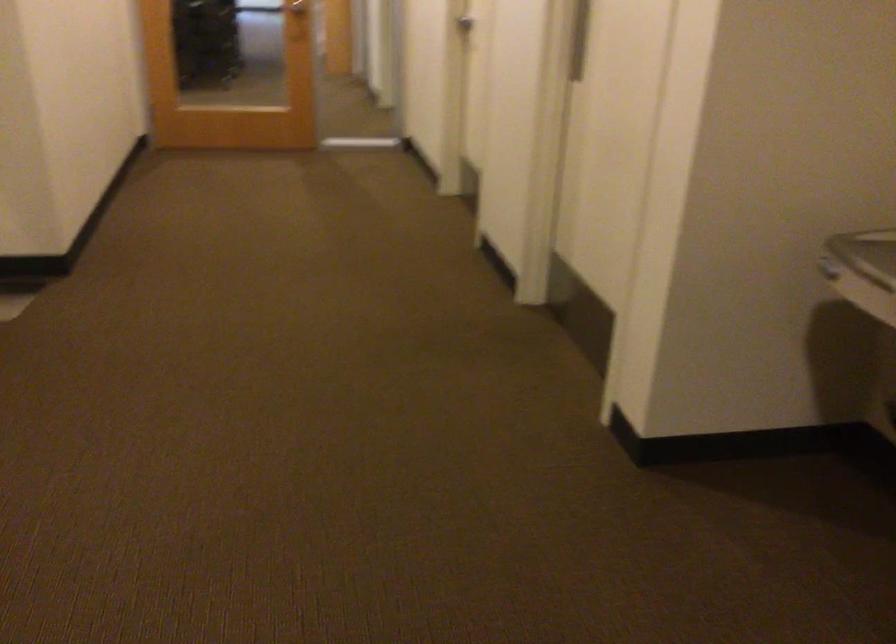
Identify the location of metal door handle. This screenshot has height=644, width=896. (464, 23).